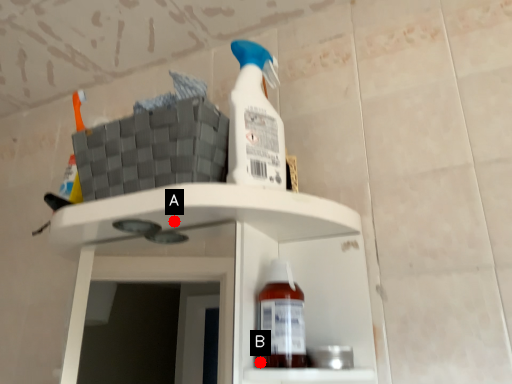
Question: Two points are circled on the image, labeled by A and B beside each circle. Which point appears farthest from the camera in this image?

Choices:
 (A) A is further
 (B) B is further

Answer: (A)